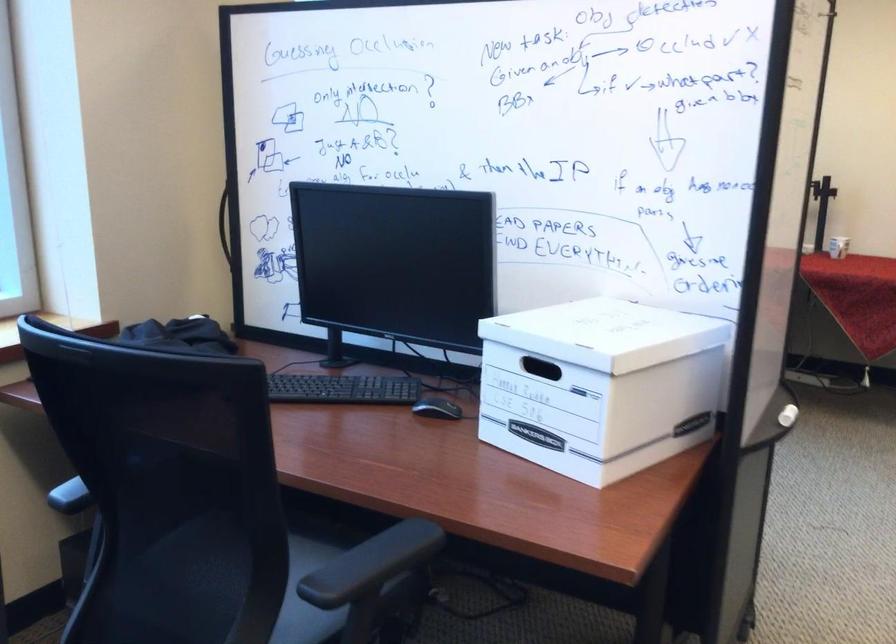
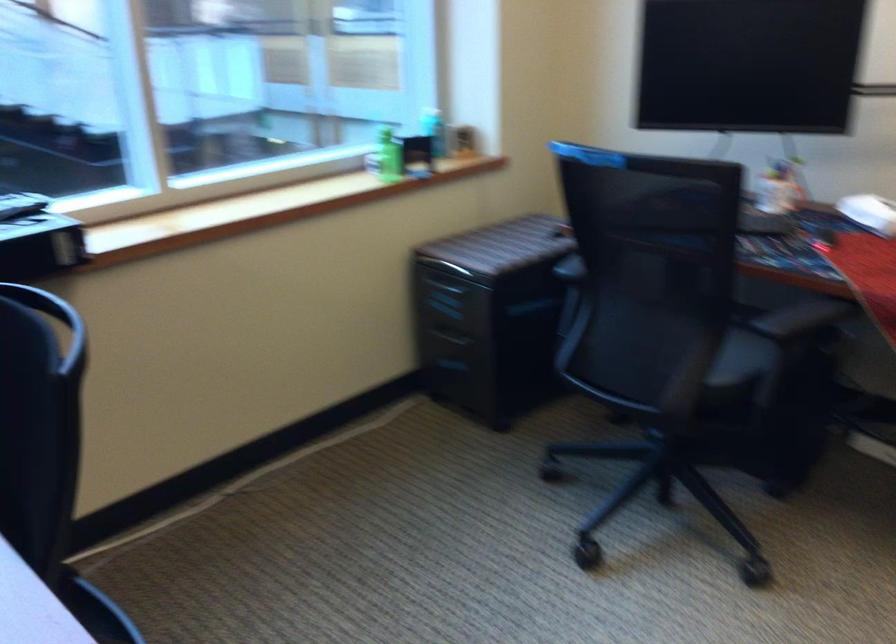
What movement of the cameraman would produce the second image?

The movement direction of the cameraman is right, forward.